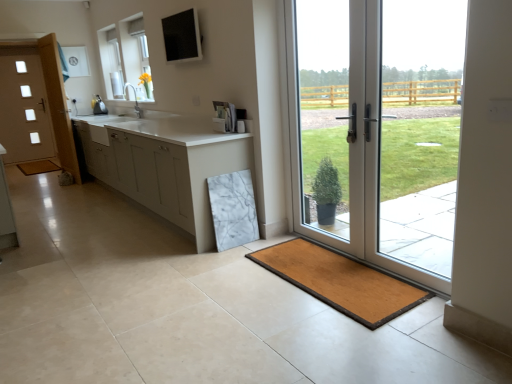
Locate an element on the screen. vacant space underneath brown rubber bath mat at lower right, placed as the first bath mat when sorted from bottom to top (from a real-world perspective) is located at coordinates (327, 279).